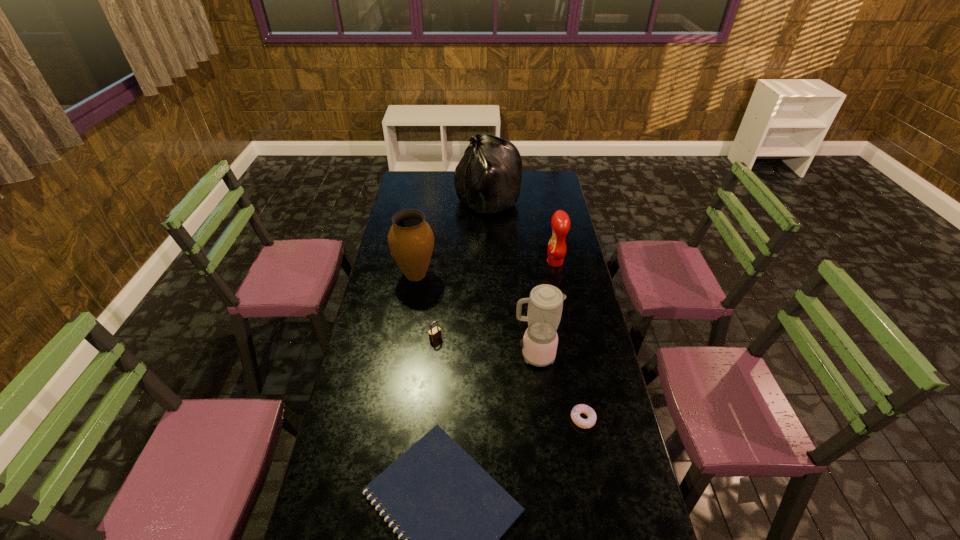
This screenshot has width=960, height=540. Identify the location of doughnut situated at the right edge. (581, 408).

At what (x,y) coordinates should I click in order to perform the action: click on vacant space at the left edge of the desktop. Please return your answer as a coordinate pair (x, y). Looking at the image, I should click on (343, 485).

Find the location of `vacant area between the food processor and the second shortest object`. vacant area between the food processor and the second shortest object is located at coordinates (559, 387).

Locate an element on the screen. unoccupied position between the condiment and the urn is located at coordinates (486, 268).

I want to click on unoccupied position between the urn and the doughnut, so click(499, 347).

Locate an element on the screen. The width and height of the screenshot is (960, 540). vacant area that lies between the plastic bag and the food processor is located at coordinates pos(511,278).

Find the location of a particular element. vacant space that's between the plastic bag and the urn is located at coordinates (451, 238).

You are a GUI agent. You are given a task and a screenshot of the screen. Output one action in this format:
    pyautogui.click(x=<x>, y=<y>)
    Task: Click on the object that is the nearest to the urn
    
    Given the screenshot: What is the action you would take?
    click(435, 333)

The height and width of the screenshot is (540, 960). I want to click on object that is the second nearest to the sixth tallest object, so click(453, 512).

What are the coordinates of `free space that satisfies the following two spatial constraints: 1. on the base of the second shortest object near the control knob; 2. on the right side of the food processor` in the screenshot? It's located at (541, 419).